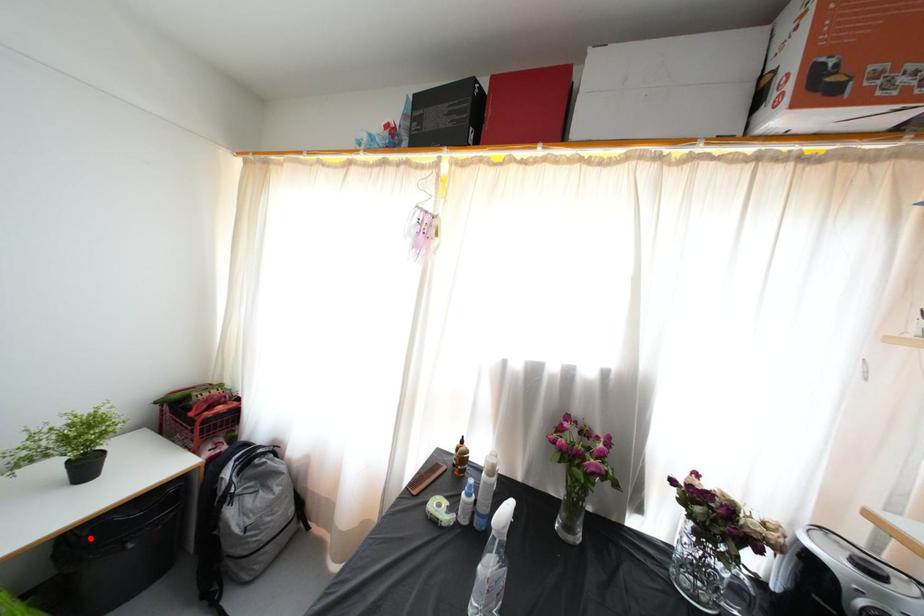
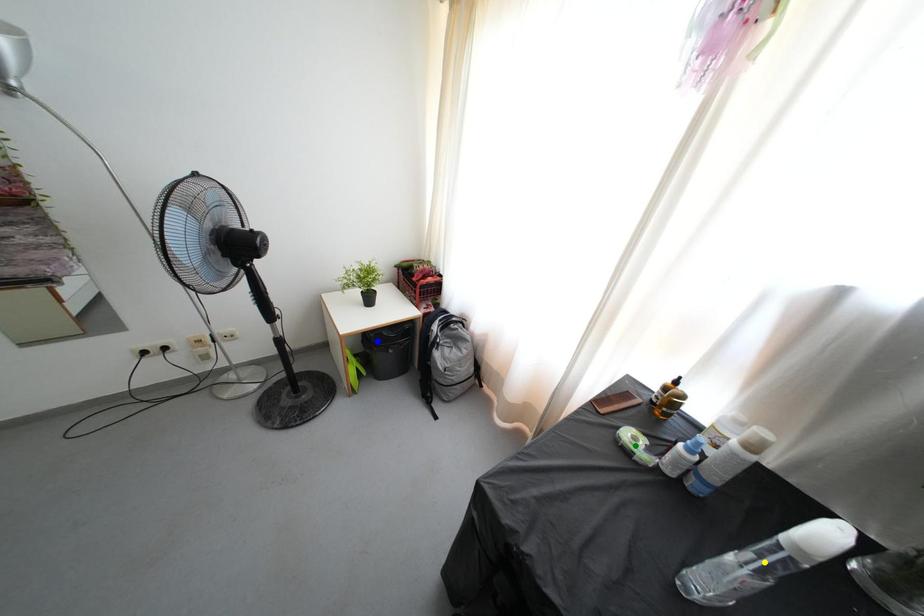
Question: I am providing you with two images of the same scene from different viewpoints. A red point is marked on the first image. You are given multiple points on the second image. Can you choose the point in image 2 that corresponds to the point in image 1?

Choices:
 (A) yellow point
 (B) green point
 (C) blue point

Answer: (C)